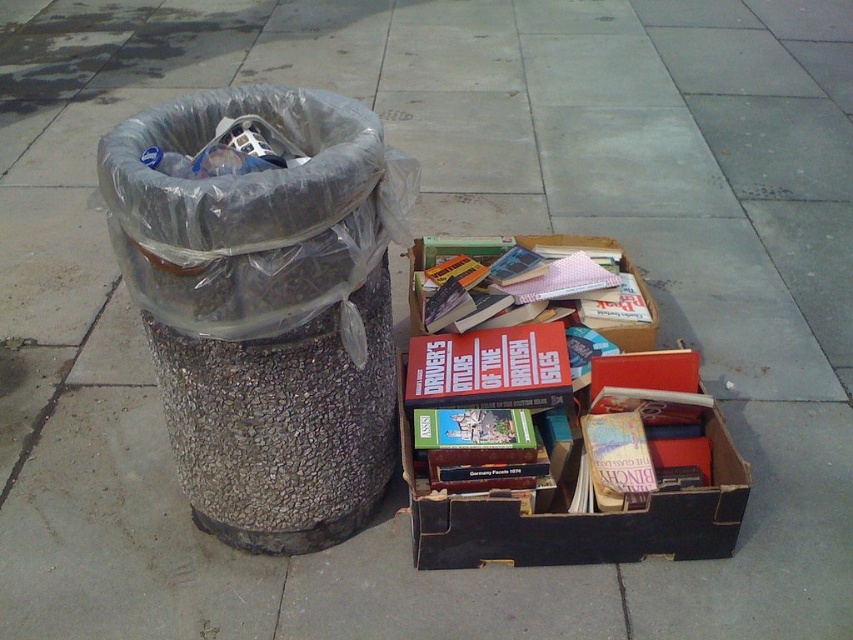
You are standing at the camera position and want to throw a banana peel into the clear plastic trash can at left. Can you reach it without moving from your current position?

The clear plastic trash can at left is 4.04 feet away from the camera. Since the average throwing distance for a banana peel is about 10 feet, you can easily reach it without moving.

You are standing at the origin point of the coordinate system. You want to move to the clear plastic trash can at left. What are the coordinates you need to move to?

The coordinates to move to are 0.480 in the x direction and 0.313 in the y direction.